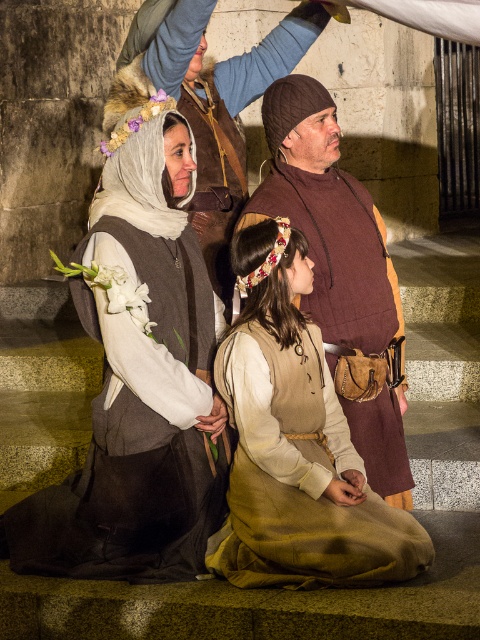
Between brown knitted vest at center and brown leather vest at center, which one has less height?

With less height is brown leather vest at center.

The width and height of the screenshot is (480, 640). Describe the element at coordinates (327, 218) in the screenshot. I see `brown knitted vest at center` at that location.

Image resolution: width=480 pixels, height=640 pixels. Find the location of `brown knitted vest at center`. brown knitted vest at center is located at coordinates (327, 218).

This screenshot has width=480, height=640. Identify the location of brown knitted vest at center. (327, 218).

Between brown leather vest at center and fluffy fur headband at upper left, which one has less height?

Standing shorter between the two is fluffy fur headband at upper left.

Between point (193, 17) and point (166, 97), which one is positioned behind?

The point (193, 17) is behind.

You are a GUI agent. You are given a task and a screenshot of the screen. Output one action in this format:
    pyautogui.click(x=<x>, y=<y>)
    Task: Click on the brown leather vest at center
    
    Given the screenshot: What is the action you would take?
    pyautogui.click(x=216, y=96)

Can you confirm if matte gray vest at center is thinner than fluffy fur headdress at upper left?

Incorrect, matte gray vest at center's width is not less than fluffy fur headdress at upper left's.

Does point (176, 156) come farther from viewer compared to point (136, 116)?

Yes.

This screenshot has height=640, width=480. What are the coordinates of `matte gray vest at center` in the screenshot? It's located at (141, 387).